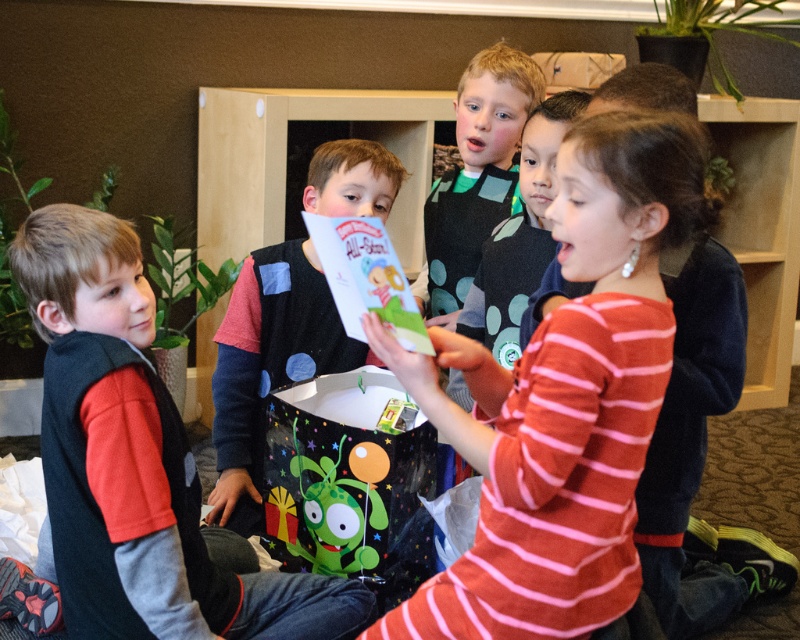
Question: Can you confirm if matte black vest at center is wider than green matte plush toy at center?

Choices:
 (A) no
 (B) yes

Answer: (B)

Question: Among these points, which one is farthest from the camera?

Choices:
 (A) (366, 451)
 (B) (134, 588)
 (C) (340, 348)

Answer: (C)

Question: Which point is closer to the camera?

Choices:
 (A) (274, 497)
 (B) (641, 262)
 (C) (345, 349)

Answer: (B)

Question: Does pink striped sweater at center appear under matte black vest at center?

Choices:
 (A) yes
 (B) no

Answer: (A)

Question: Estimate the real-world distances between objects in this image. Which object is closer to the matte black vest at center?

Choices:
 (A) velvet black vest at left
 (B) pink striped sweater at center

Answer: (A)

Question: Is velvet black vest at left above matte black vest at center?

Choices:
 (A) yes
 (B) no

Answer: (B)